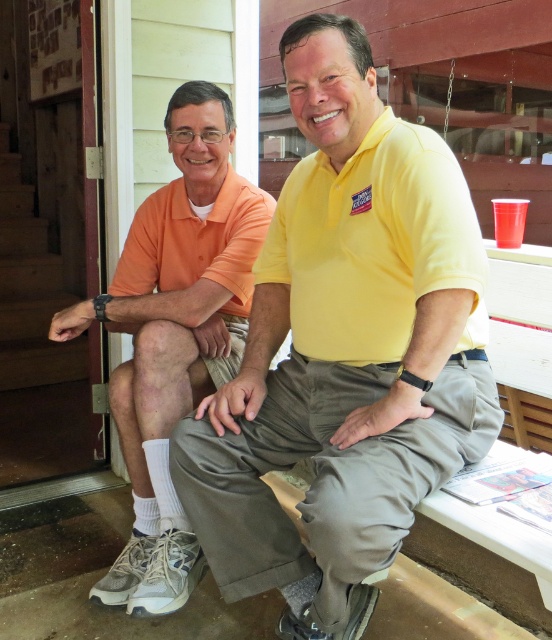
You are a photographer trying to capture both the yellow matte shirt at center and the orange cotton shirt at left in a single frame. Given that the camera can only focus on objects within a 30 cm width, can both shirts fit side by side without overlapping?

The yellow matte shirt at center has a larger width than the orange cotton shirt at left. Since the camera requires both to fit within 30 cm, and the combined width of both shirts exceeds 30 cm, they cannot fit side by side without overlapping.

You are a photographer standing 5 feet away from the yellow matte shirt at center. Can you take a clear photo of it without moving closer?

The yellow matte shirt at center is 3.82 feet away from the camera, which is within the 5 feet distance you are standing. Therefore, you can take a clear photo of it without moving closer.

From the picture: You are a photographer trying to capture both the yellow matte shirt at center and the orange cotton shirt at left in a single frame. Based on their heights, which shirt should you focus on first to ensure both are in focus?

The yellow matte shirt at center has a lesser height compared to the orange cotton shirt at left, so you should focus on the orange cotton shirt at left first to ensure both are in focus.